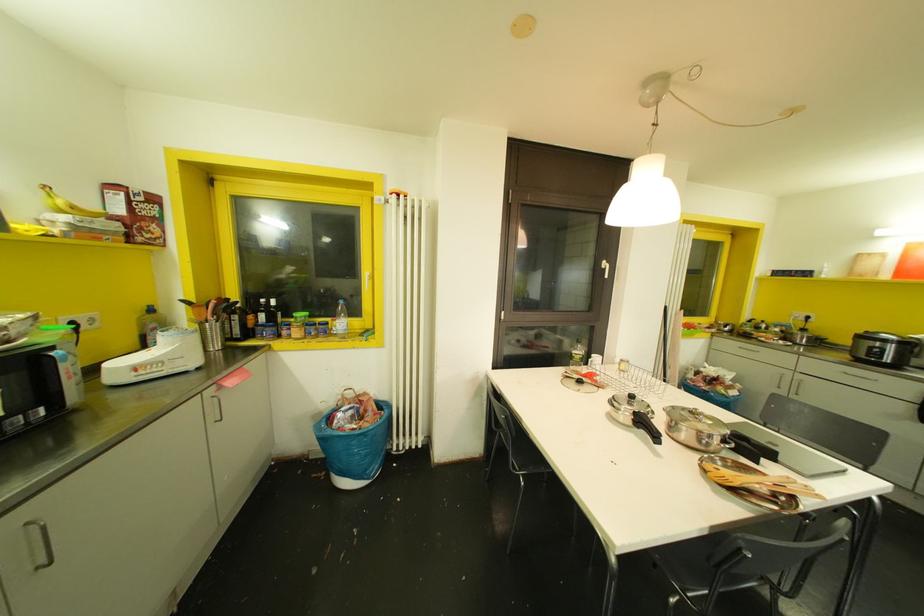
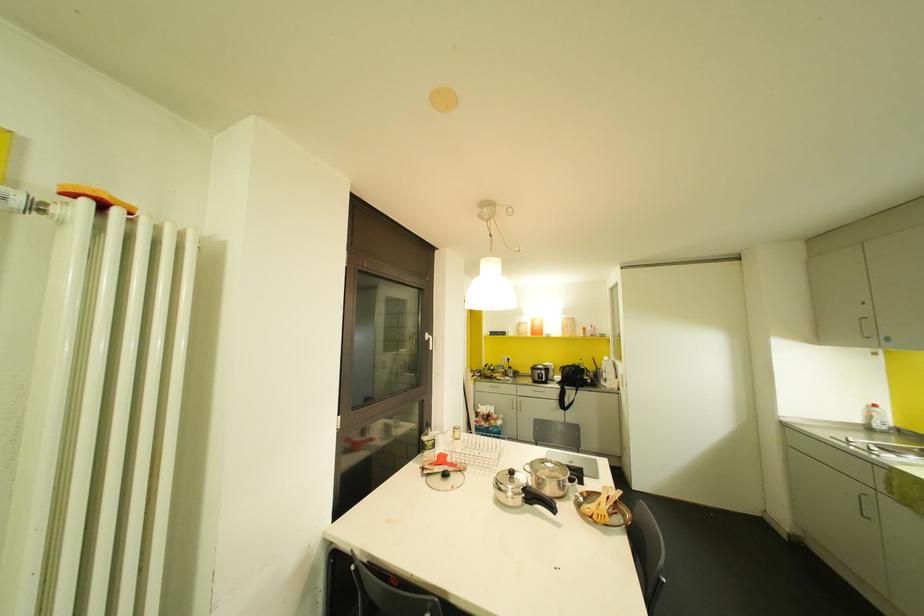
Find the pixel in the second image that matches point 577,357 in the first image.

(429, 444)